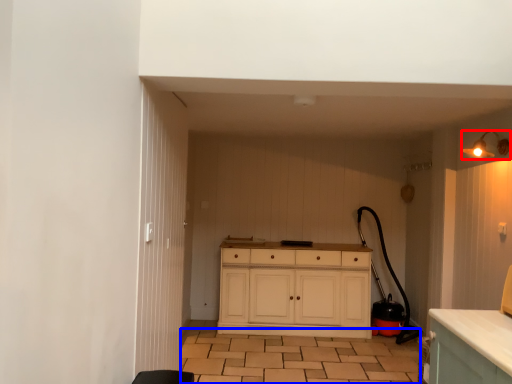
Question: Which point is closer to the camera, light fixture (highlighted by a red box) or tile (highlighted by a blue box)?

Choices:
 (A) light fixture
 (B) tile

Answer: (A)